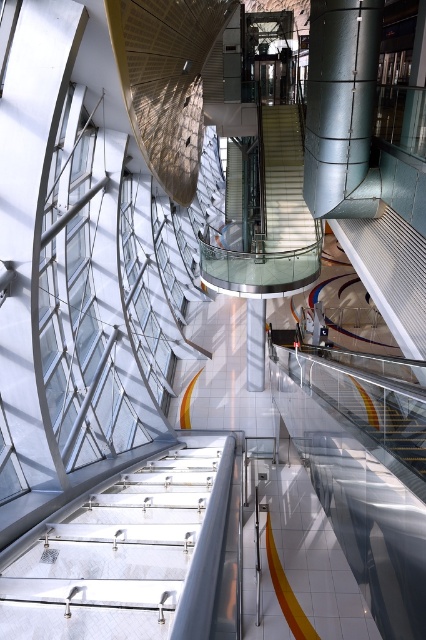
Question: Observing the image, what is the correct spatial positioning of metallic silver stairs at center in reference to white glossy stairs at center?

Choices:
 (A) below
 (B) above

Answer: (A)

Question: Does metallic silver stairs at center have a smaller size compared to metallic silver pillar at upper center?

Choices:
 (A) yes
 (B) no

Answer: (A)

Question: Based on their relative distances, which object is nearer to the metallic silver pillar at upper center?

Choices:
 (A) white glossy pillar at center
 (B) white glossy stairs at center
 (C) metallic silver stairs at center

Answer: (A)

Question: Estimate the real-world distances between objects in this image. Which object is closer to the metallic silver pillar at upper center?

Choices:
 (A) white glossy stairs at center
 (B) white glossy pillar at center

Answer: (B)

Question: Among these points, which one is nearest to the camera?

Choices:
 (A) (172, 557)
 (B) (264, 189)

Answer: (A)

Question: Can you confirm if metallic silver pillar at upper center is wider than white glossy pillar at center?

Choices:
 (A) no
 (B) yes

Answer: (B)